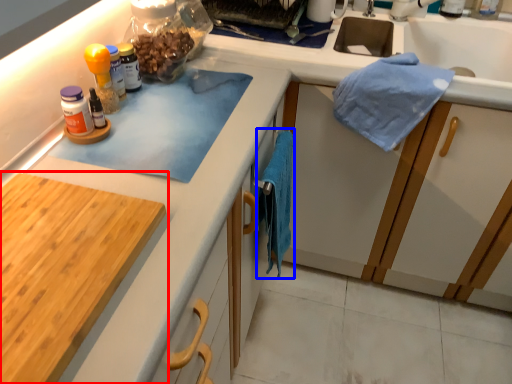
Question: Which object appears farthest to the camera in this image, cabinetry (highlighted by a red box) or bath towel (highlighted by a blue box)?

Choices:
 (A) cabinetry
 (B) bath towel

Answer: (B)